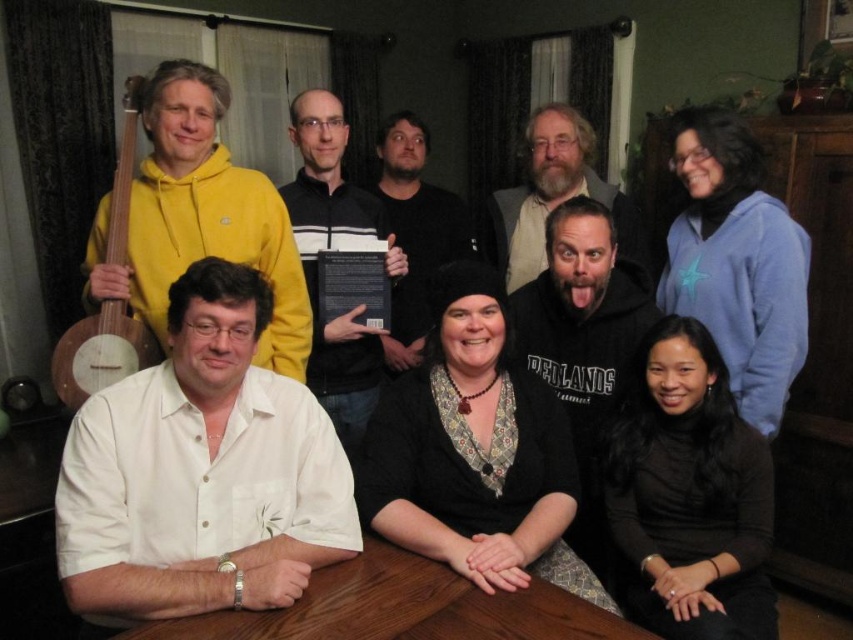
You are standing at the camera position and want to reach point (399,579). Is the distance more than 1.5 meters?

The distance between you and point (399,579) is 1.42 meters, which is less than 1.5 meters.

You are a person who needs to place a 38 inch long object on the brown wooden table at center and the black paper at center. Which surface can accommodate the object without exceeding its length?

The brown wooden table at center is 39.25 inches from the black paper at center, so the distance between them is 39.25 inches. Since the object is 38 inches long, it can fit on either surface as both have sufficient length to accommodate it.